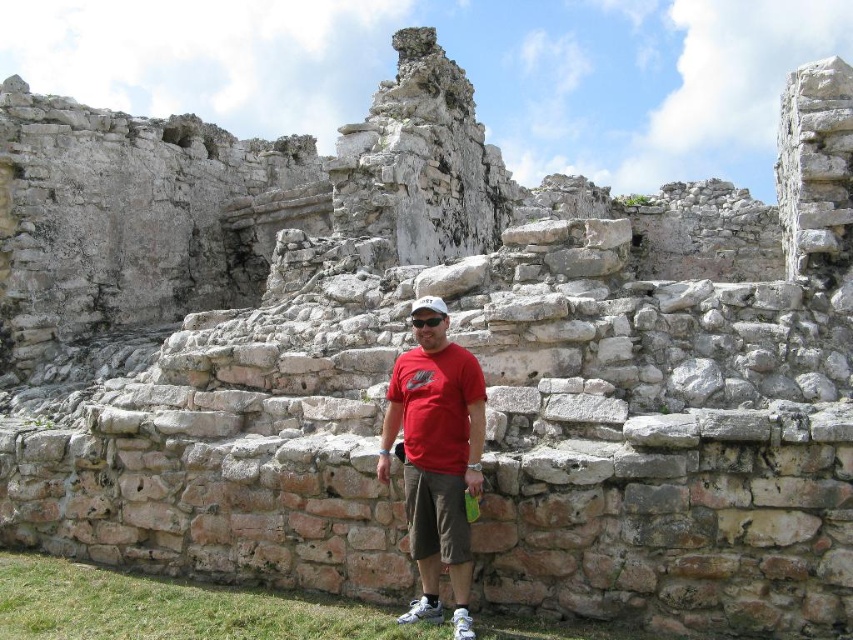
Is matte red t-shirt at center above white matte baseball cap at center?

No.

In the scene shown: Can you confirm if matte red t-shirt at center is positioned to the right of white matte baseball cap at center?

Yes, matte red t-shirt at center is to the right of white matte baseball cap at center.

Which is behind, point (439, 506) or point (436, 308)?

Point (436, 308)

Identify the location of matte red t-shirt at center. [436, 460].